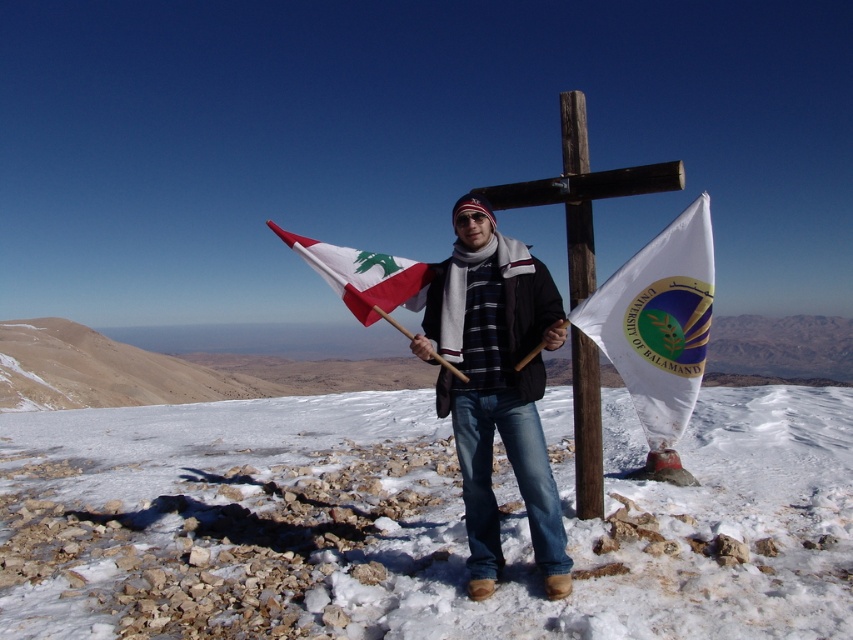
Question: Is wooden at center thinner than white fabric flag at center?

Choices:
 (A) no
 (B) yes

Answer: (B)

Question: Is white powdery snow at center smaller than white fabric flag at right?

Choices:
 (A) no
 (B) yes

Answer: (A)

Question: Which point is farther to the camera?

Choices:
 (A) (527, 497)
 (B) (321, 262)
 (C) (579, 404)

Answer: (C)

Question: Considering the relative positions of dark blue jeans at center and wooden pole at center in the image provided, where is dark blue jeans at center located with respect to wooden pole at center?

Choices:
 (A) right
 (B) left

Answer: (B)

Question: Which of these objects is positioned closest to the white fabric flag at right?

Choices:
 (A) dark blue jeans at center
 (B) wooden pole at center
 (C) wooden at center

Answer: (A)

Question: Among these points, which one is farthest from the camera?

Choices:
 (A) (515, 456)
 (B) (575, 282)
 (C) (734, 445)

Answer: (C)